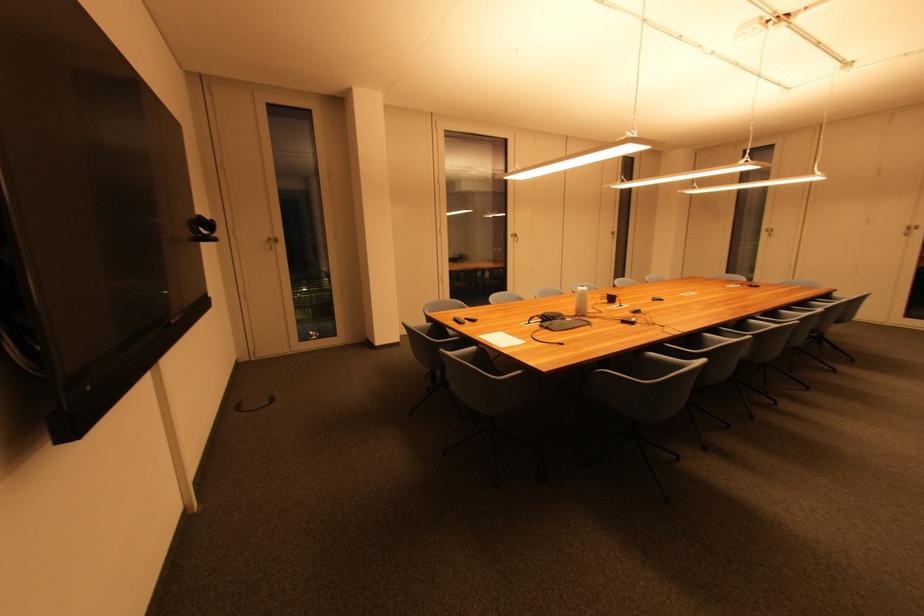
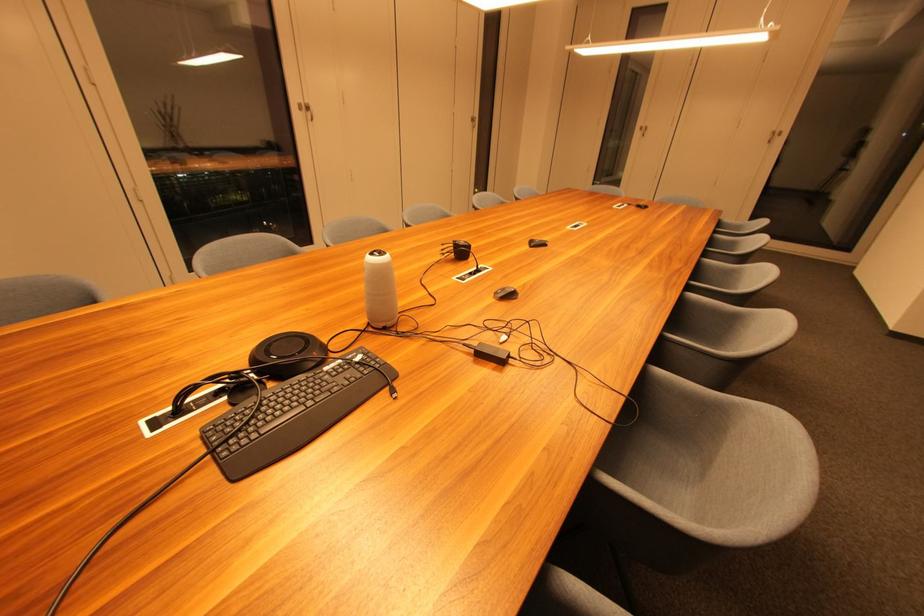
The point at (642, 314) is marked in the first image. Where is the corresponding point in the second image?

(515, 298)